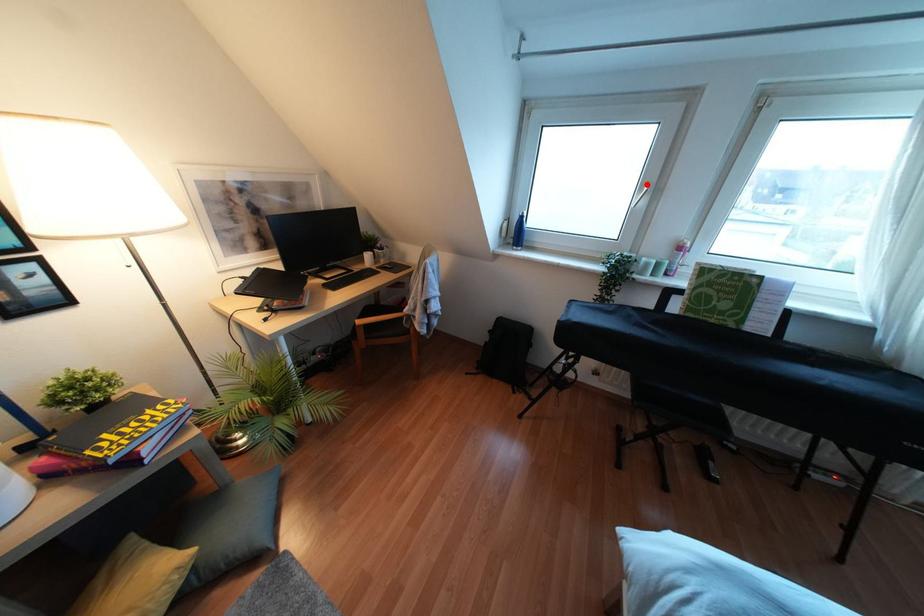
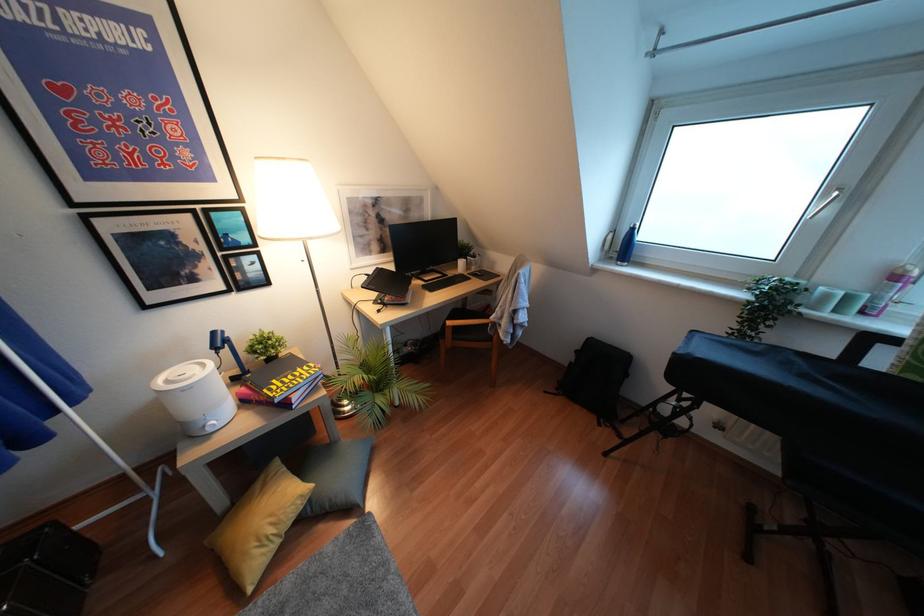
Where in the second image is the point corresponding to the highlighted location from the first image?

(839, 188)